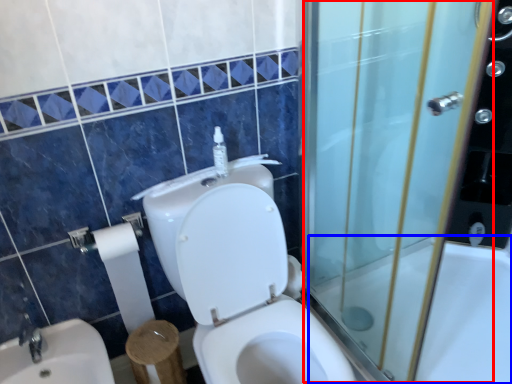
Question: Which point is further to the camera, screen door (highlighted by a red box) or bath (highlighted by a blue box)?

Choices:
 (A) screen door
 (B) bath

Answer: (B)